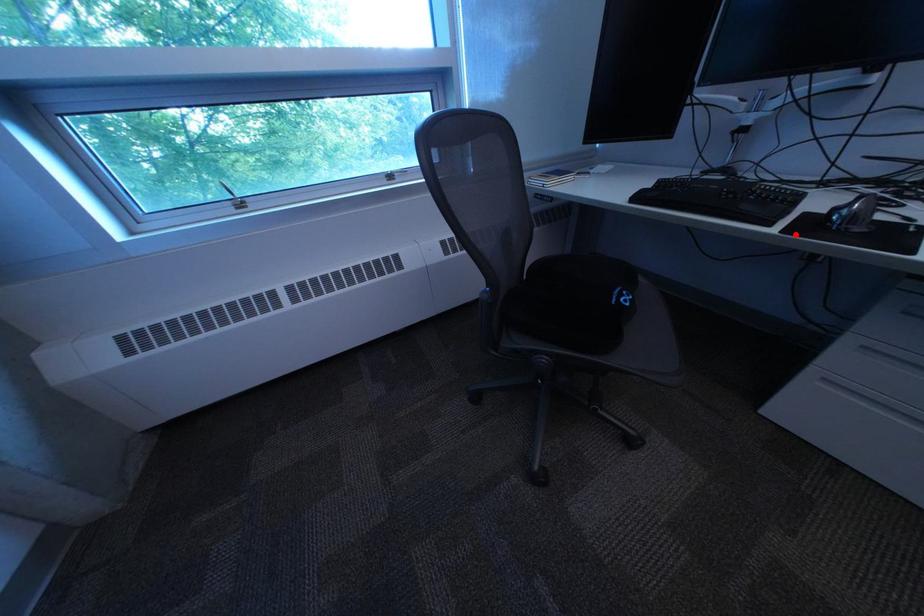
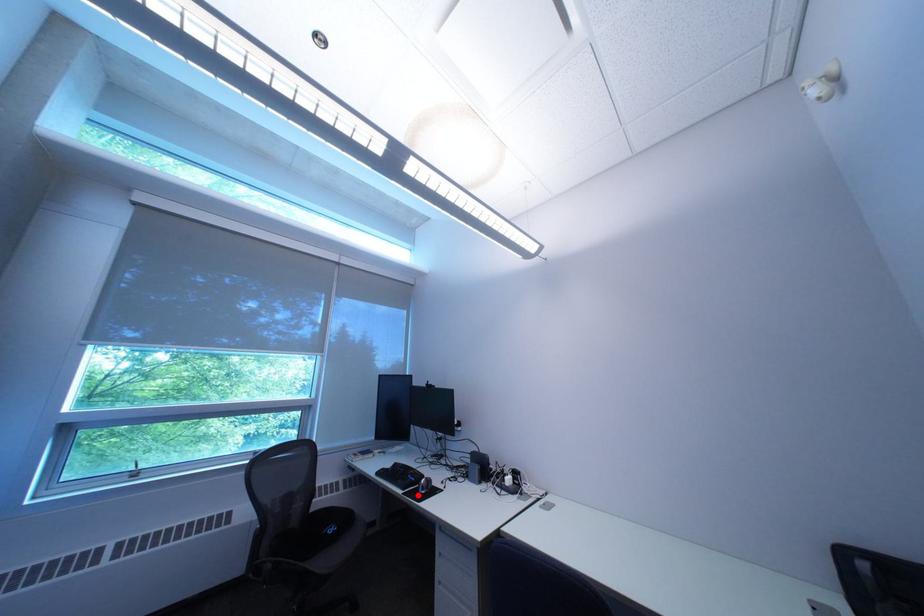
I am providing you with two images of the same scene from different viewpoints. A red point is marked on the first image and another point is marked on the second image. Is the red point in image1 aligned with the point shown in image2?

Yes